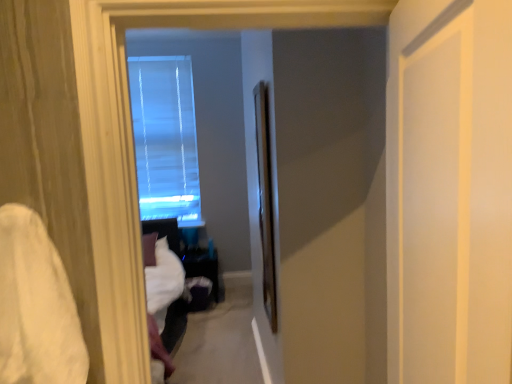
Question: Is clear glass screen door at center, acting as the 2th screen door starting from the front, thinner than white soft fabric at left?

Choices:
 (A) no
 (B) yes

Answer: (B)

Question: Is clear glass screen door at center, acting as the 2th screen door starting from the front, completely or partially outside of white soft fabric at left?

Choices:
 (A) no
 (B) yes

Answer: (B)

Question: Is clear glass screen door at center, acting as the 2th screen door starting from the front, further to camera compared to white soft fabric at left?

Choices:
 (A) no
 (B) yes

Answer: (B)

Question: Does clear glass screen door at center, which ranks as the first screen door in left-to-right order, have a smaller size compared to white soft fabric at left?

Choices:
 (A) no
 (B) yes

Answer: (A)

Question: Does clear glass screen door at center, the first screen door positioned from the back, have a greater height compared to white soft fabric at left?

Choices:
 (A) no
 (B) yes

Answer: (B)

Question: From a real-world perspective, is white matte door at right, positioned as the 2th screen door in left-to-right order, above or below clear glass screen door at center, acting as the 2th screen door starting from the front?

Choices:
 (A) below
 (B) above

Answer: (B)

Question: Is white matte door at right, positioned as the 2th screen door in left-to-right order, in front of or behind clear glass screen door at center, which ranks as the first screen door in left-to-right order, in the image?

Choices:
 (A) front
 (B) behind

Answer: (A)

Question: Is white matte door at right, positioned as the second screen door in back-to-front order, taller or shorter than clear glass screen door at center, acting as the 2th screen door starting from the right?

Choices:
 (A) short
 (B) tall

Answer: (A)

Question: Looking at their shapes, would you say white matte door at right, placed as the 1th screen door when sorted from right to left, is wider or thinner than clear glass screen door at center, the first screen door positioned from the back?

Choices:
 (A) wide
 (B) thin

Answer: (A)

Question: Do you think transparent glass window at center is within white soft fabric at left, or outside of it?

Choices:
 (A) outside
 (B) inside

Answer: (A)

Question: Looking at the image, does transparent glass window at center seem bigger or smaller compared to white soft fabric at left?

Choices:
 (A) big
 (B) small

Answer: (A)

Question: From the image's perspective, relative to white soft fabric at left, is transparent glass window at center above or below?

Choices:
 (A) above
 (B) below

Answer: (A)

Question: Would you say transparent glass window at center is to the left or to the right of white soft fabric at left in the picture?

Choices:
 (A) left
 (B) right

Answer: (A)

Question: Visually, is white soft fabric at left positioned to the left or to the right of clear glass screen door at center, acting as the 2th screen door starting from the right?

Choices:
 (A) left
 (B) right

Answer: (A)

Question: Relative to clear glass screen door at center, acting as the 2th screen door starting from the right, is white soft fabric at left in front or behind?

Choices:
 (A) front
 (B) behind

Answer: (A)